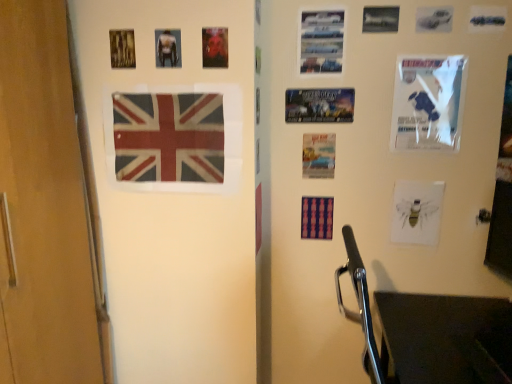
Question: Is metallic silver car at upper right, which ranks as the 1th poster page in right-to-left order, next to metallic silver cars at upper right, which is the 5th poster page in left-to-right order?

Choices:
 (A) no
 (B) yes

Answer: (A)

Question: Considering the relative positions of metallic silver car at upper right, which ranks as the 1th poster page in right-to-left order, and metallic silver cars at upper right, which is the 7th poster page from right to left, in the image provided, is metallic silver car at upper right, which ranks as the 1th poster page in right-to-left order, to the right of metallic silver cars at upper right, which is the 7th poster page from right to left, from the viewer's perspective?

Choices:
 (A) yes
 (B) no

Answer: (A)

Question: From the image's perspective, is metallic silver car at upper right, which ranks as the 1th poster page in right-to-left order, above metallic silver cars at upper right, which is the 5th poster page in left-to-right order?

Choices:
 (A) no
 (B) yes

Answer: (B)

Question: From the image's perspective, does metallic silver car at upper right, which ranks as the 1th poster page in right-to-left order, appear lower than metallic silver cars at upper right, which is the 5th poster page in left-to-right order?

Choices:
 (A) no
 (B) yes

Answer: (A)

Question: Does metallic silver car at upper right, which ranks as the 1th poster page in right-to-left order, appear on the left side of metallic silver cars at upper right, which is the 5th poster page in left-to-right order?

Choices:
 (A) no
 (B) yes

Answer: (A)

Question: Does point (501, 9) appear closer or farther from the camera than point (309, 170)?

Choices:
 (A) farther
 (B) closer

Answer: (B)

Question: Choose the correct answer: Is metallic silver car at upper right, arranged as the eleventh poster page when viewed from the left, inside matte paper poster at center, the sixth poster page viewed from the left, or outside it?

Choices:
 (A) outside
 (B) inside

Answer: (A)

Question: From the image's perspective, is metallic silver car at upper right, arranged as the eleventh poster page when viewed from the left, positioned above or below matte paper poster at center, the sixth poster page viewed from the left?

Choices:
 (A) above
 (B) below

Answer: (A)

Question: Relative to matte paper poster at center, the sixth poster page viewed from the left, is metallic silver car at upper right, arranged as the eleventh poster page when viewed from the left, in front or behind?

Choices:
 (A) front
 (B) behind

Answer: (A)

Question: From a real-world perspective, is metallic silver car at upper right, which ranks as the 1th poster page in right-to-left order, positioned above or below metallic silver cars at upper right, which is the 7th poster page from right to left?

Choices:
 (A) above
 (B) below

Answer: (A)

Question: Is point (493, 28) positioned closer to the camera than point (343, 26)?

Choices:
 (A) farther
 (B) closer

Answer: (B)

Question: In terms of width, does metallic silver car at upper right, arranged as the eleventh poster page when viewed from the left, look wider or thinner when compared to metallic silver cars at upper right, which is the 5th poster page in left-to-right order?

Choices:
 (A) wide
 (B) thin

Answer: (B)

Question: In the image, is metallic silver car at upper right, which ranks as the 1th poster page in right-to-left order, positioned in front of or behind metallic silver cars at upper right, which is the 5th poster page in left-to-right order?

Choices:
 (A) front
 (B) behind

Answer: (A)

Question: Do you think matte paper poster at center, the sixth poster page viewed from the left, is within metallic silver airplane at upper right, which ranks as the 5th poster page in right-to-left order, or outside of it?

Choices:
 (A) inside
 (B) outside

Answer: (B)

Question: From the image's perspective, is matte paper poster at center, placed as the sixth poster page when sorted from right to left, located above or below metallic silver airplane at upper right, which ranks as the 5th poster page in right-to-left order?

Choices:
 (A) below
 (B) above

Answer: (A)